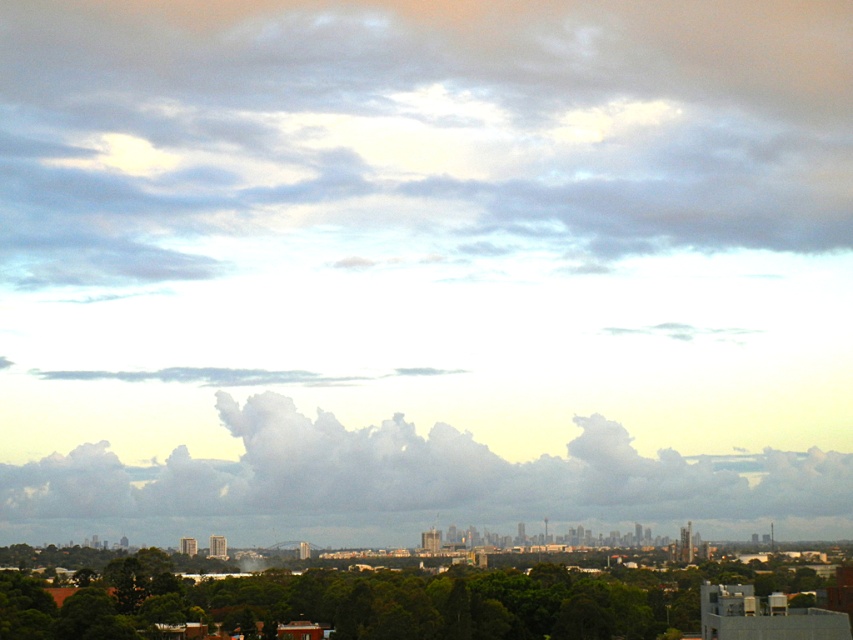
Question: Does white fluffy cloud at center appear on the left side of green leafy tree at lower center?

Choices:
 (A) no
 (B) yes

Answer: (A)

Question: Estimate the real-world distances between objects in this image. Which object is farther from the cloudy sky at upper center?

Choices:
 (A) white fluffy cloud at center
 (B) green leafy tree at lower center

Answer: (B)

Question: Among these points, which one is farthest from the camera?

Choices:
 (A) coord(453,26)
 (B) coord(552,468)

Answer: (A)

Question: Is cloudy sky at upper center positioned before white fluffy cloud at center?

Choices:
 (A) yes
 (B) no

Answer: (B)

Question: Does cloudy sky at upper center lie in front of white fluffy cloud at center?

Choices:
 (A) yes
 (B) no

Answer: (B)

Question: Which object is farther from the camera taking this photo?

Choices:
 (A) cloudy sky at upper center
 (B) green leafy tree at lower center
 (C) white fluffy cloud at center

Answer: (B)